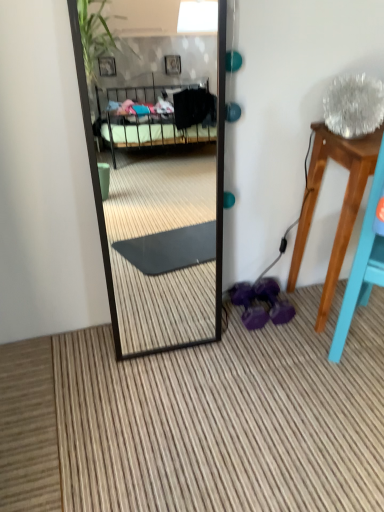
Question: From the image's perspective, is wooden stool at right over purple rubber dumbbells at lower center?

Choices:
 (A) no
 (B) yes

Answer: (B)

Question: Is wooden stool at right smaller than purple rubber dumbbells at lower center?

Choices:
 (A) yes
 (B) no

Answer: (B)

Question: Can you confirm if wooden stool at right is positioned to the left of purple rubber dumbbells at lower center?

Choices:
 (A) no
 (B) yes

Answer: (A)

Question: Is wooden stool at right closer to the viewer compared to purple rubber dumbbells at lower center?

Choices:
 (A) yes
 (B) no

Answer: (A)

Question: Is wooden stool at right completely or partially outside of purple rubber dumbbells at lower center?

Choices:
 (A) no
 (B) yes

Answer: (B)

Question: Could you tell me if wooden stool at right is turned towards purple rubber dumbbells at lower center?

Choices:
 (A) no
 (B) yes

Answer: (A)

Question: Does purple rubber dumbbells at lower center have a greater width compared to wooden stool at right?

Choices:
 (A) no
 (B) yes

Answer: (A)

Question: Would you consider purple rubber dumbbells at lower center to be distant from wooden stool at right?

Choices:
 (A) yes
 (B) no

Answer: (B)

Question: Is purple rubber dumbbells at lower center to the left of wooden stool at right from the viewer's perspective?

Choices:
 (A) no
 (B) yes

Answer: (B)

Question: Considering the relative sizes of purple rubber dumbbells at lower center and wooden stool at right in the image provided, is purple rubber dumbbells at lower center shorter than wooden stool at right?

Choices:
 (A) yes
 (B) no

Answer: (A)

Question: From a real-world perspective, is purple rubber dumbbells at lower center below wooden stool at right?

Choices:
 (A) yes
 (B) no

Answer: (A)

Question: From the image's perspective, is purple rubber dumbbells at lower center beneath wooden stool at right?

Choices:
 (A) no
 (B) yes

Answer: (B)

Question: Do you think wooden stool at right is within purple rubber dumbbells at lower center, or outside of it?

Choices:
 (A) outside
 (B) inside

Answer: (A)